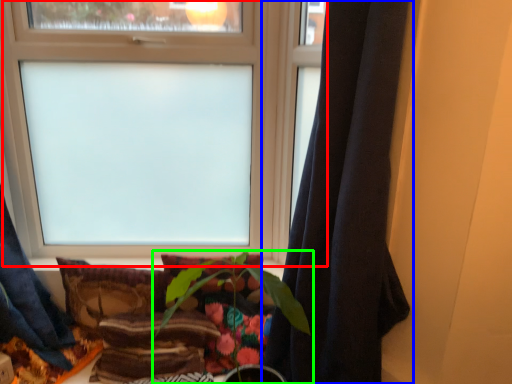
Question: Based on their relative distances, which object is farther from window (highlighted by a red box)? Choose from curtain (highlighted by a blue box) and houseplant (highlighted by a green box).

Choices:
 (A) curtain
 (B) houseplant

Answer: (A)